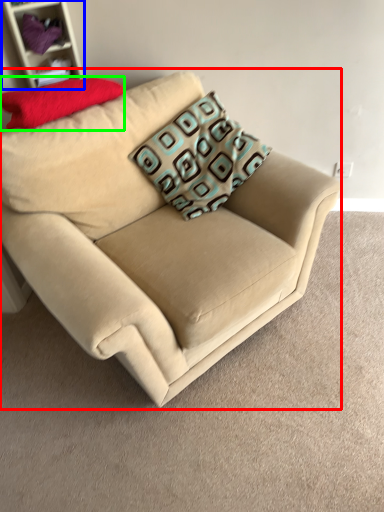
Question: Which object is positioned farthest from studio couch (highlighted by a red box)? Select from shelf (highlighted by a blue box) and pillow (highlighted by a green box).

Choices:
 (A) shelf
 (B) pillow

Answer: (A)